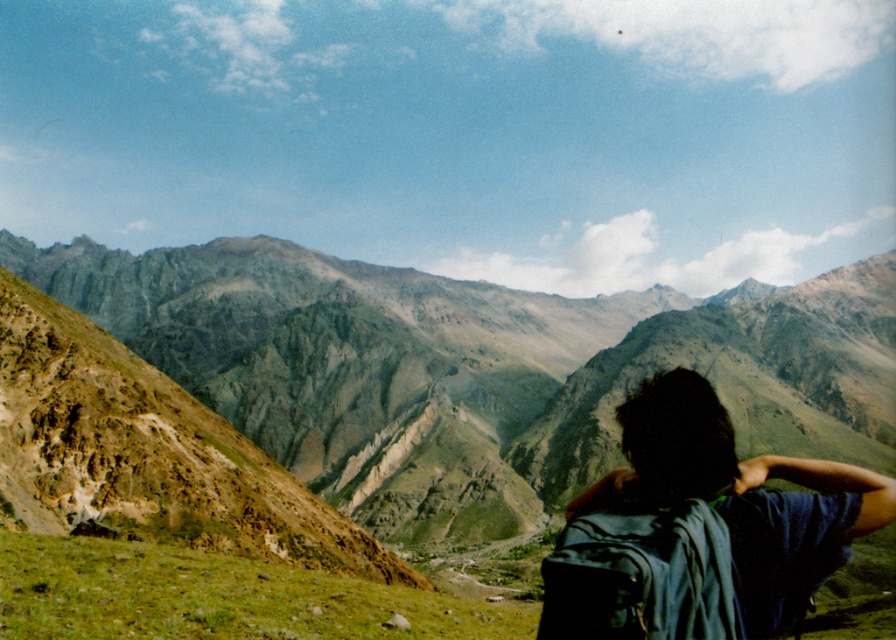
At what (x,y) coordinates should I click in order to perform the action: click on green rocky mountains at center. Please return your answer as a coordinate pair (x, y). Looking at the image, I should click on (476, 371).

Between green rocky mountains at center and dark blue fabric backpack at lower right, which one appears on the left side from the viewer's perspective?

green rocky mountains at center is more to the left.

Describe the element at coordinates (476, 371) in the screenshot. I see `green rocky mountains at center` at that location.

You are a GUI agent. You are given a task and a screenshot of the screen. Output one action in this format:
    pyautogui.click(x=<x>, y=<y>)
    Task: Click on the green rocky mountains at center
    This screenshot has width=896, height=640.
    Given the screenshot: What is the action you would take?
    pyautogui.click(x=476, y=371)

Is dark blue fabric backpack at lower right to the left of matte black backpack at center from the viewer's perspective?

No, dark blue fabric backpack at lower right is not to the left of matte black backpack at center.

This screenshot has width=896, height=640. I want to click on dark blue fabric backpack at lower right, so click(739, 497).

The width and height of the screenshot is (896, 640). What do you see at coordinates (739, 497) in the screenshot? I see `dark blue fabric backpack at lower right` at bounding box center [739, 497].

Locate an element on the screen. dark blue fabric backpack at lower right is located at coordinates (739, 497).

Does green rocky mountains at center have a lesser width compared to matte black backpack at center?

In fact, green rocky mountains at center might be wider than matte black backpack at center.

Is point (481, 396) positioned in front of point (662, 509)?

No, it is not.

Which is behind, point (845, 392) or point (699, 564)?

Positioned behind is point (845, 392).

At what (x,y) coordinates should I click in order to perform the action: click on green rocky mountains at center. Please return your answer as a coordinate pair (x, y). The width and height of the screenshot is (896, 640). Looking at the image, I should click on (476, 371).